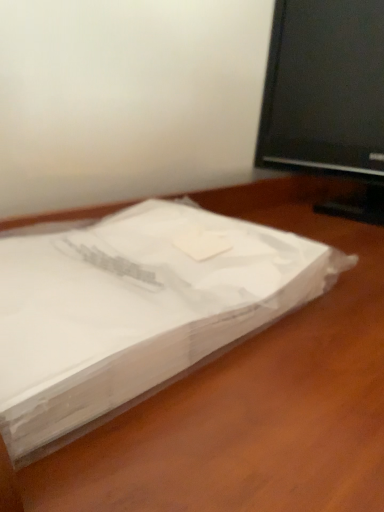
What is the approximate width of white paper at center?

white paper at center is 17.85 inches in width.

Where is `white paper at center`? white paper at center is located at coordinates (250, 398).

What do you see at coordinates (250, 398) in the screenshot?
I see `white paper at center` at bounding box center [250, 398].

Where is `black glossy television at upper right`? This screenshot has width=384, height=512. black glossy television at upper right is located at coordinates pos(327,98).

This screenshot has width=384, height=512. Describe the element at coordinates (327, 98) in the screenshot. I see `black glossy television at upper right` at that location.

Find the location of a particular element. This screenshot has height=512, width=384. white paper at center is located at coordinates (250, 398).

Considering the relative positions of black glossy television at upper right and white paper at center in the image provided, is black glossy television at upper right to the right of white paper at center from the viewer's perspective?

Yes, black glossy television at upper right is to the right of white paper at center.

Is the depth of black glossy television at upper right greater than that of white paper at center?

Yes, black glossy television at upper right is behind white paper at center.

Is point (375, 5) positioned in front of point (342, 462)?

No, (375, 5) is further to viewer.

From the image's perspective, is black glossy television at upper right over white paper at center?

Yes, from the image's perspective, black glossy television at upper right is over white paper at center.

From a real-world perspective, does black glossy television at upper right sit lower than white paper at center?

Incorrect, from a real-world perspective, black glossy television at upper right is higher than white paper at center.

Considering the relative sizes of black glossy television at upper right and white paper at center in the image provided, is black glossy television at upper right thinner than white paper at center?

Correct, the width of black glossy television at upper right is less than that of white paper at center.

Who is taller, black glossy television at upper right or white paper at center?

white paper at center.

From the picture: Considering the sizes of objects black glossy television at upper right and white paper at center in the image provided, who is bigger, black glossy television at upper right or white paper at center?

With larger size is white paper at center.

Would you say black glossy television at upper right is outside white paper at center?

Absolutely, black glossy television at upper right is external to white paper at center.

Is black glossy television at upper right placed right next to white paper at center?

No, black glossy television at upper right is not making contact with white paper at center.

Is black glossy television at upper right positioned with its back to white paper at center?

black glossy television at upper right does not have its back to white paper at center.

How far apart are black glossy television at upper right and white paper at center?

black glossy television at upper right and white paper at center are 13.14 inches apart from each other.

Identify the location of desk on the left of black glossy television at upper right. The height and width of the screenshot is (512, 384). (250, 398).

Is white paper at center to the left or to the right of black glossy television at upper right in the image?

Clearly, white paper at center is on the left of black glossy television at upper right in the image.

Which object is more forward, white paper at center or black glossy television at upper right?

Positioned in front is white paper at center.

Is point (120, 494) positioned after point (328, 202)?

No, (120, 494) is in front of (328, 202).

From the image's perspective, would you say white paper at center is shown under black glossy television at upper right?

Indeed, from the image's perspective, white paper at center is shown beneath black glossy television at upper right.

From a real-world perspective, is white paper at center over black glossy television at upper right?

No.

In terms of width, does white paper at center look wider or thinner when compared to black glossy television at upper right?

white paper at center is wider than black glossy television at upper right.

Does white paper at center have a greater height compared to black glossy television at upper right?

Yes, white paper at center is taller than black glossy television at upper right.

Considering the relative sizes of white paper at center and black glossy television at upper right in the image provided, is white paper at center bigger than black glossy television at upper right?

Yes, white paper at center is bigger than black glossy television at upper right.

Is black glossy television at upper right inside white paper at center?

No.

Is white paper at center touching black glossy television at upper right?

No, white paper at center is not making contact with black glossy television at upper right.

Could you tell me if white paper at center is turned towards black glossy television at upper right?

No.

How different are the orientations of white paper at center and black glossy television at upper right in degrees?

There is a 0.696-degree angle between the facing directions of white paper at center and black glossy television at upper right.

Measure the distance between white paper at center and black glossy television at upper right.

white paper at center and black glossy television at upper right are 13.14 inches apart from each other.

You are a GUI agent. You are given a task and a screenshot of the screen. Output one action in this format:
    pyautogui.click(x=<x>, y=<y>)
    Task: Click on the desk on the left side of black glossy television at upper right
    This screenshot has width=384, height=512.
    Given the screenshot: What is the action you would take?
    pyautogui.click(x=250, y=398)

In the image, there is a white paper at center. At what (x,y) coordinates should I click in order to perform the action: click on television above it (from the image's perspective). Please return your answer as a coordinate pair (x, y). The image size is (384, 512). Looking at the image, I should click on (327, 98).

Image resolution: width=384 pixels, height=512 pixels. I want to click on desk lying on the left of black glossy television at upper right, so click(250, 398).